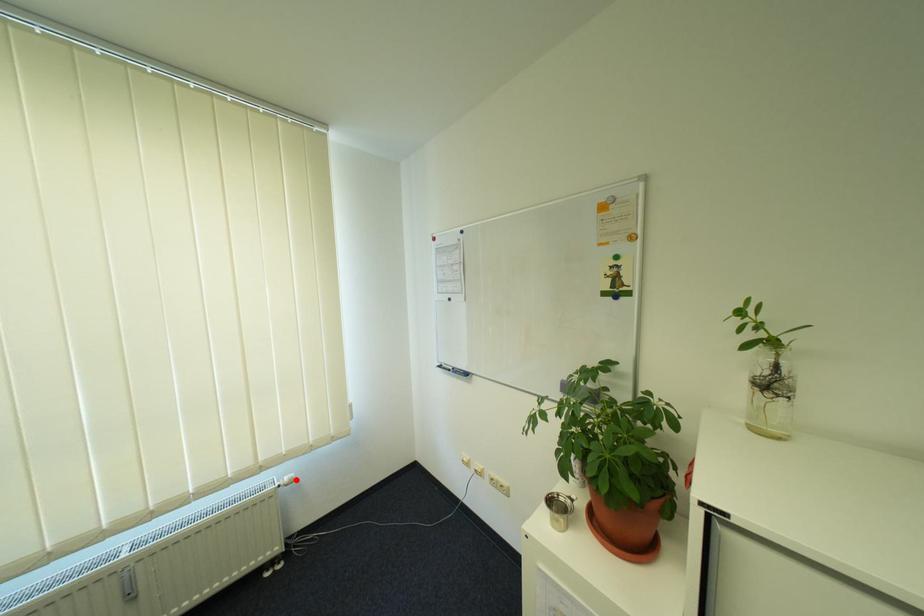
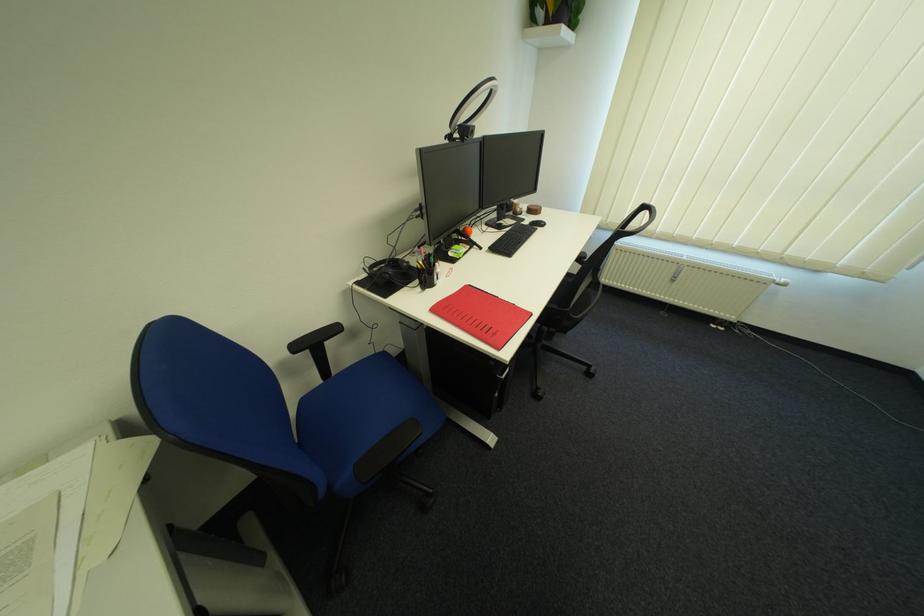
Find the pixel in the second image that matches the highlighted location in the first image.

(793, 281)